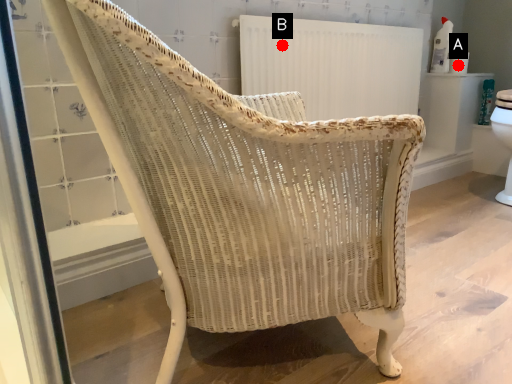
Question: Two points are circled on the image, labeled by A and B beside each circle. Which of the following is the closest to the observer?

Choices:
 (A) A is closer
 (B) B is closer

Answer: (B)